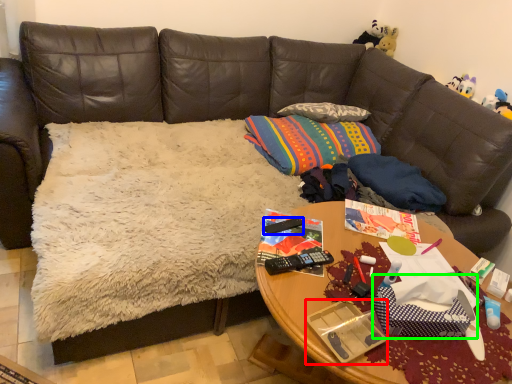
Question: Estimate the real-world distances between objects in this image. Which object is farther from package (highlighted by a red box), remote control (highlighted by a blue box) or gift bag (highlighted by a green box)?

Choices:
 (A) remote control
 (B) gift bag

Answer: (A)